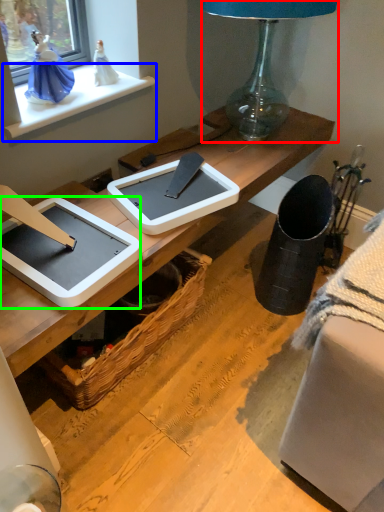
Question: Based on their relative distances, which object is nearer to lamp (highlighted by a red box)? Choose from window sill (highlighted by a blue box) and tablet computer (highlighted by a green box).

Choices:
 (A) window sill
 (B) tablet computer

Answer: (A)